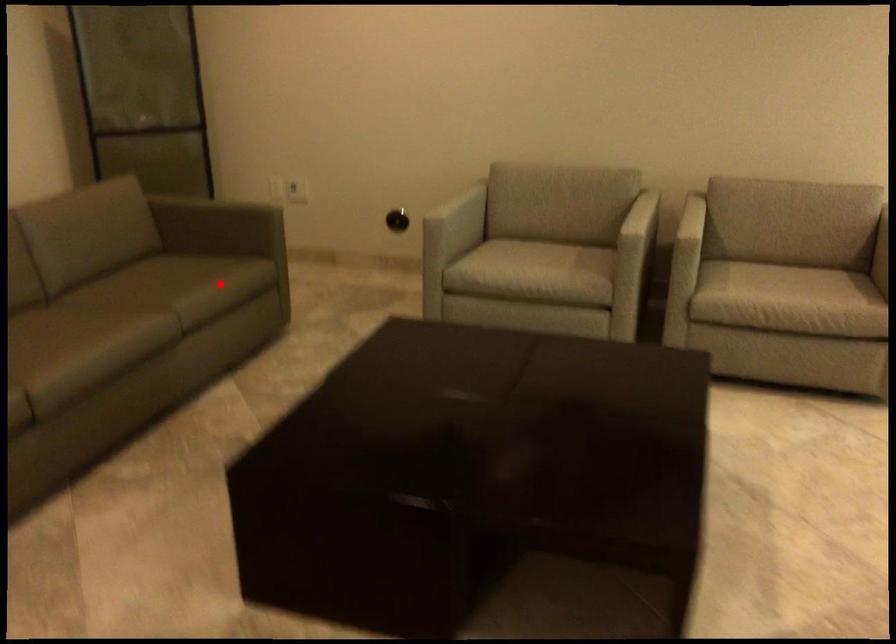
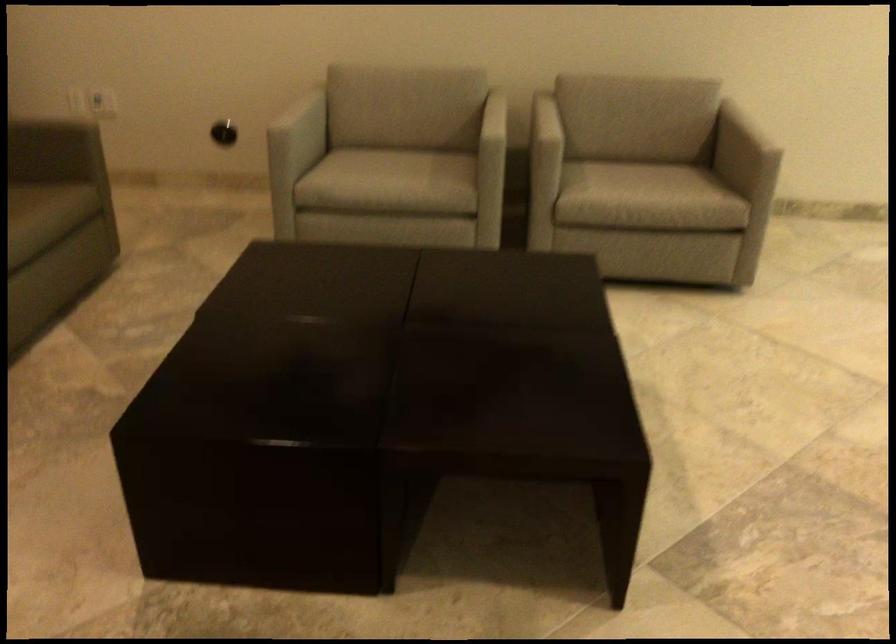
Question: I am providing you with two images of the same scene from different viewpoints. Image1 has a red point marked. In image2, the corresponding 3D location appears at what relative position? Reply with the corresponding letter.

Choices:
 (A) Closer
 (B) Farther

Answer: (A)